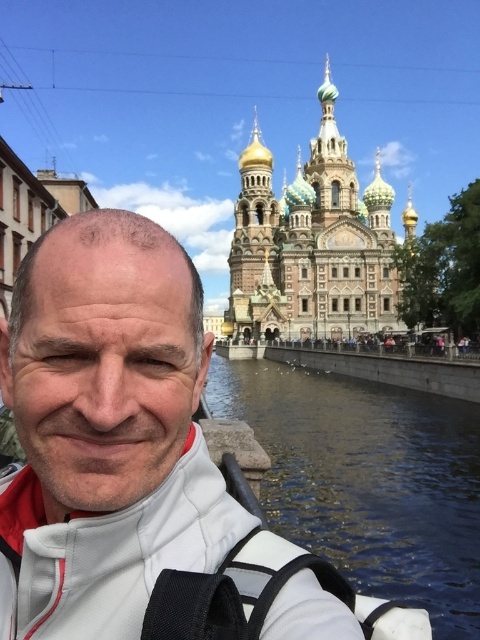
Question: Which of the following is the closest to the observer?

Choices:
 (A) (363, 403)
 (B) (83, 486)

Answer: (B)

Question: Does dark blue water at center appear over golden domed cathedral at upper center?

Choices:
 (A) no
 (B) yes

Answer: (A)

Question: Which of the following is the farthest from the observer?

Choices:
 (A) golden domed cathedral at upper center
 (B) white quilted jacket at lower center

Answer: (A)

Question: Considering the relative positions of white quilted jacket at lower center and dark blue water at center in the image provided, where is white quilted jacket at lower center located with respect to dark blue water at center?

Choices:
 (A) left
 (B) right

Answer: (A)

Question: Which point is farther to the camera?

Choices:
 (A) click(x=442, y=451)
 (B) click(x=348, y=305)

Answer: (B)

Question: Can you confirm if white quilted jacket at lower center is thinner than golden domed cathedral at upper center?

Choices:
 (A) no
 (B) yes

Answer: (B)